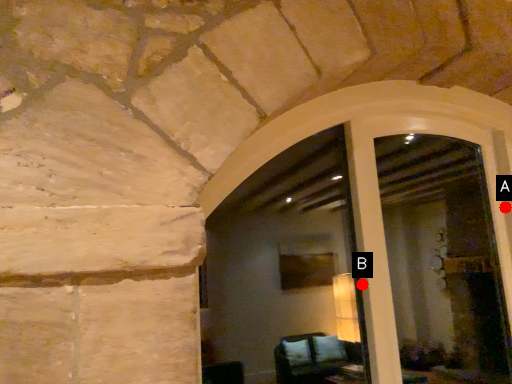
Question: Two points are circled on the image, labeled by A and B beside each circle. Which point is closer to the camera?

Choices:
 (A) A is closer
 (B) B is closer

Answer: (B)